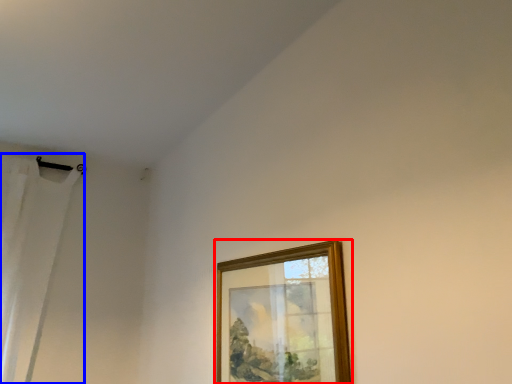
Question: Which object is further to the camera taking this photo, picture frame (highlighted by a red box) or curtain (highlighted by a blue box)?

Choices:
 (A) picture frame
 (B) curtain

Answer: (B)